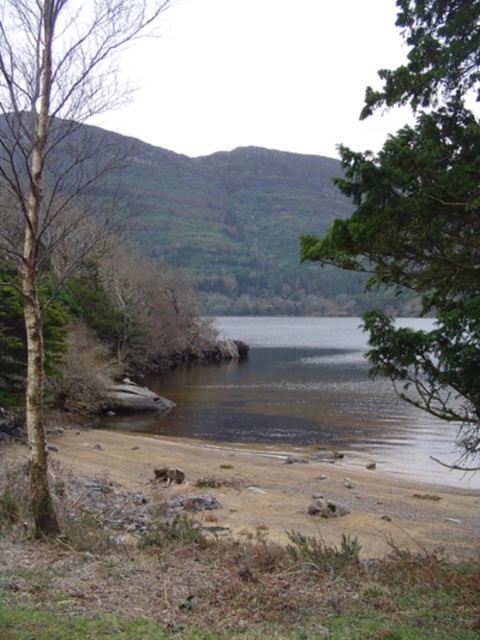
Question: Which object is the farthest from the brown smooth water at lower center?

Choices:
 (A) bare bark tree at left
 (B) brown sand at lower left

Answer: (A)

Question: Can you confirm if bare bark tree at left is wider than brown sand at lower left?

Choices:
 (A) no
 (B) yes

Answer: (A)

Question: Does green leafy tree at upper right lie in front of brown smooth water at lower center?

Choices:
 (A) yes
 (B) no

Answer: (A)

Question: Is bare bark tree at left bigger than brown sand at lower left?

Choices:
 (A) no
 (B) yes

Answer: (B)

Question: Among these points, which one is nearest to the camera?

Choices:
 (A) (87, 234)
 (B) (148, 476)

Answer: (B)

Question: Which object is the farthest from the bare bark tree at left?

Choices:
 (A) brown smooth water at lower center
 (B) brown sand at lower left
 (C) green leafy tree at upper right

Answer: (A)